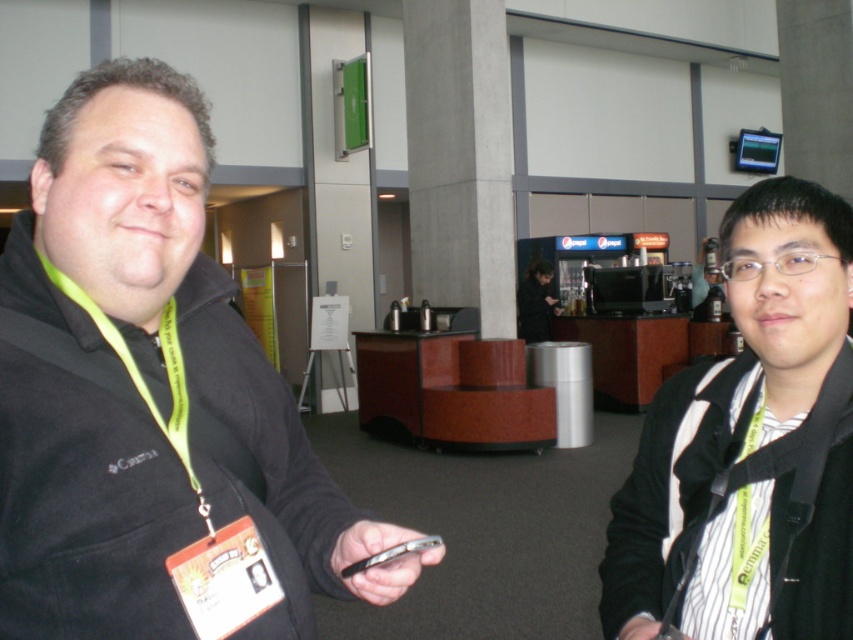
You are an event organizer who needs to place a 4 inch wide decorative plaque between the black fleece jacket at center and the green fabric lanyard at left. Based on the scene, will the plaque fit between them?

The black fleece jacket at center and green fabric lanyard at left are 3.94 inches apart from each other. Since the plaque is 4 inches wide, it will not fit between them as the space is slightly narrower than the plaque.

You are an event organizer and need to locate the black matte jacket at center for a quick costume change. According to the coordinates provided, where exactly should you look in the image?

The black matte jacket at center is located at point coordinates of (x=750, y=448).

You are an event organizer who needs to guide a guest to the beverage station. The guest is currently facing the black fleece jacket at center and the green fabric lanyard at left. Which direction should they turn to find the beverage station located behind the reception desk?

The black fleece jacket at center is to the right of the green fabric lanyard at left. Since the beverage station is behind the reception desk, the guest should turn left to face the direction of the beverage station.